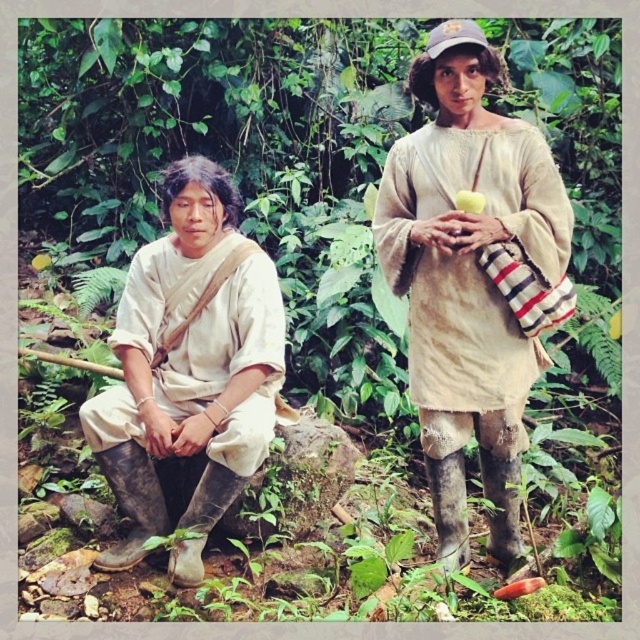
Question: Which object is farther from the camera taking this photo?

Choices:
 (A) matte white shirt at left
 (B) green matte apple at upper center

Answer: (A)

Question: Does matte white shirt at left appear under green matte apple at upper center?

Choices:
 (A) yes
 (B) no

Answer: (A)

Question: Estimate the real-world distances between objects in this image. Which object is farther from the matte white shirt at left?

Choices:
 (A) green matte apple at upper center
 (B) matte beige robe at center

Answer: (A)

Question: Among these objects, which one is farthest from the camera?

Choices:
 (A) matte white shirt at left
 (B) matte beige robe at center
 (C) green matte apple at upper center

Answer: (A)

Question: Does matte white shirt at left come in front of green matte apple at upper center?

Choices:
 (A) yes
 (B) no

Answer: (B)

Question: Can you confirm if matte white shirt at left is bigger than green matte apple at upper center?

Choices:
 (A) no
 (B) yes

Answer: (B)